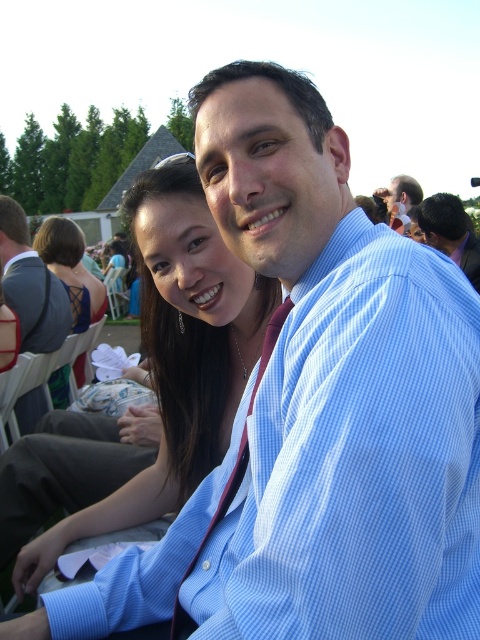
Is matte black dress at center above gray fabric chair at left?

No.

Between point (37, 580) and point (23, 339), which one is positioned behind?

Positioned behind is point (23, 339).

Where is `matte black dress at center`? The width and height of the screenshot is (480, 640). matte black dress at center is located at coordinates (153, 385).

Can you confirm if gray fabric chair at left is positioned below matte black dress at left?

Yes, gray fabric chair at left is below matte black dress at left.

Does point (61, 310) come farther from viewer compared to point (72, 316)?

No, it is in front of (72, 316).

Identify the location of gray fabric chair at left. The width and height of the screenshot is (480, 640). (31, 284).

Describe the element at coordinates (71, 269) in the screenshot. This screenshot has height=640, width=480. I see `matte black dress at left` at that location.

Is matte black dress at left smaller than blue striped shirt at upper right?

Indeed, matte black dress at left has a smaller size compared to blue striped shirt at upper right.

Who is more forward, (63, 403) or (464, 269)?

Point (464, 269) is in front.

You are a GUI agent. You are given a task and a screenshot of the screen. Output one action in this format:
    pyautogui.click(x=<x>, y=<y>)
    Task: Click on the matte black dress at left
    
    Given the screenshot: What is the action you would take?
    pyautogui.click(x=71, y=269)